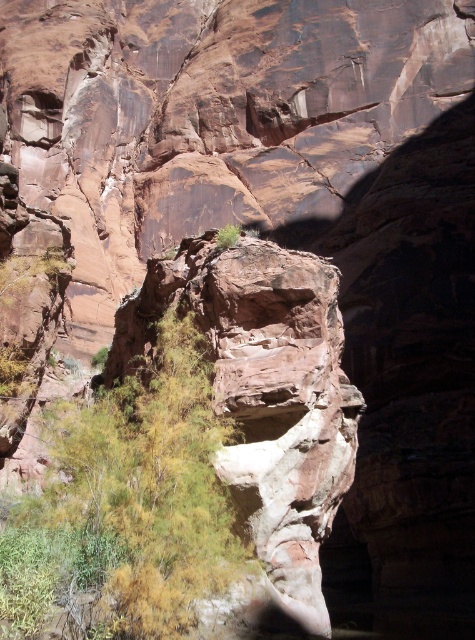
You are a hiker standing at the base of the rustic stone cliff at center and the green leafy shrub at center. Which object is taller?

The rustic stone cliff at center is taller than the green leafy shrub at center.

You are a hiker who wants to take a photo of the rustic stone cliff at center and the green leafy shrub at center. Which object should you focus on first if you want to capture both in a single frame without moving the camera?

The rustic stone cliff at center is above the green leafy shrub at center, so you should focus on the green leafy shrub at center first to ensure both are in focus since it is closer to the camera.

You are a hiker trying to navigate through the canyon. You see the rustic stone cliff at center and the green leafy shrub at center. Which one would you need to go around because it takes up more space?

The rustic stone cliff at center has a larger size compared to the green leafy shrub at center, so you would need to go around the rustic stone cliff at center because it takes up more space.